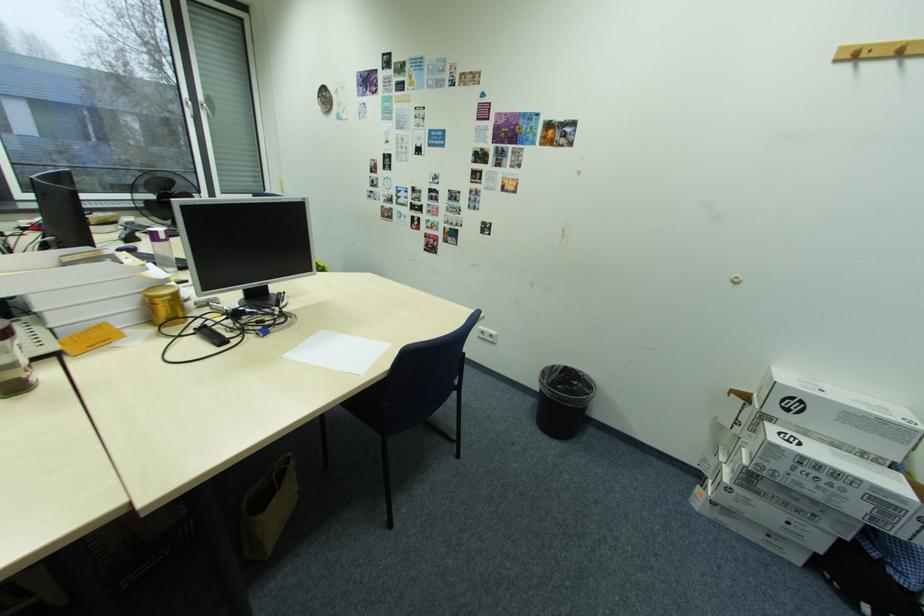
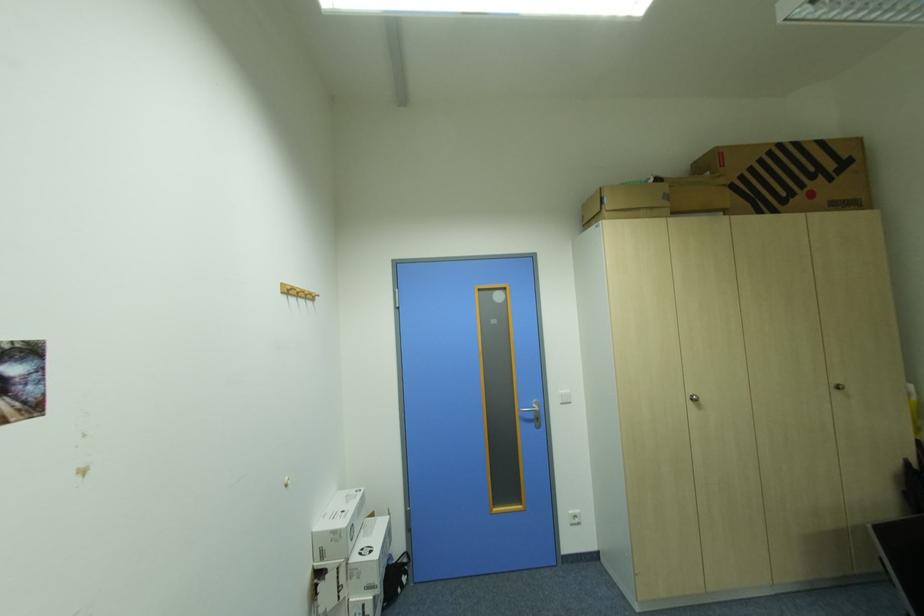
Find the pixel in the second image that matches pixel 758 455 in the first image.

(377, 590)